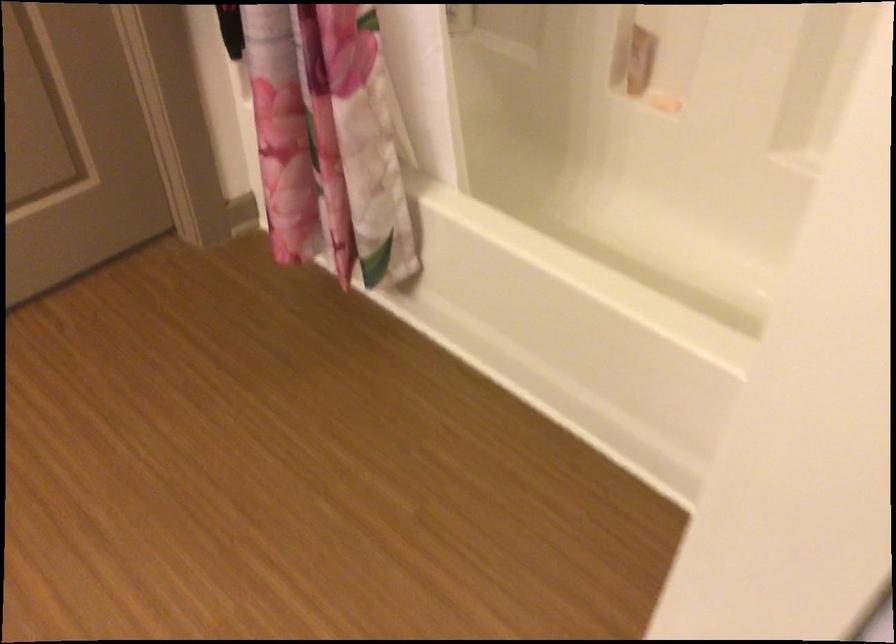
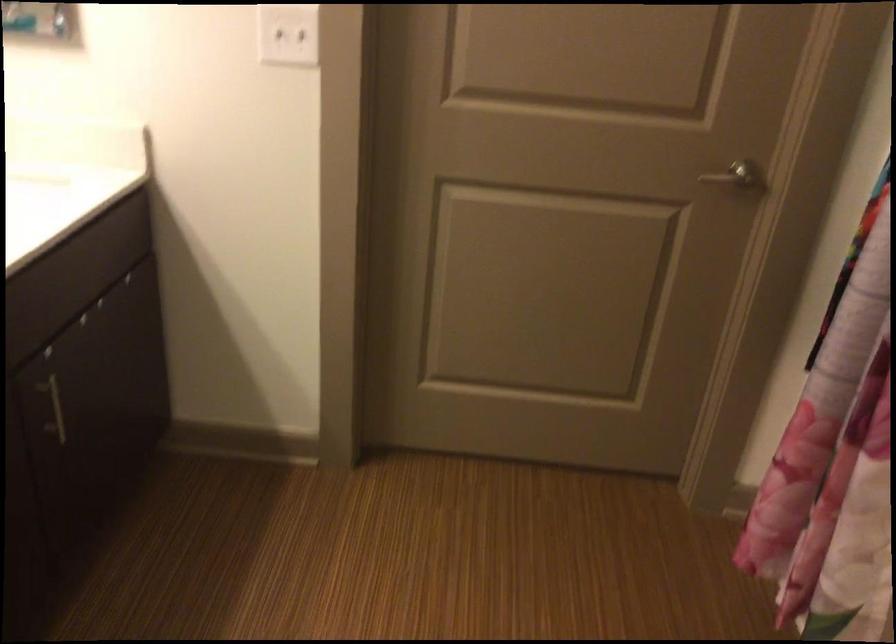
Question: The first image is from the beginning of the video and the second image is from the end. How did the camera likely rotate when shooting the video?

Choices:
 (A) Left
 (B) Right
 (C) Up
 (D) Down

Answer: (A)